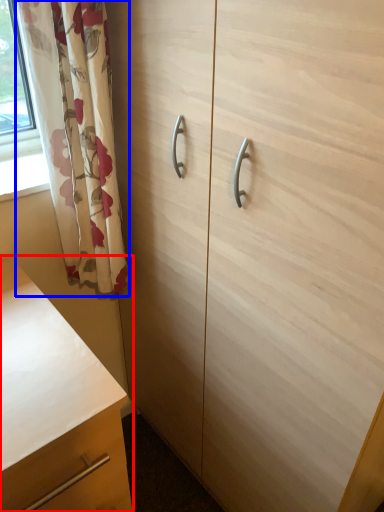
Question: Which object appears closest to the camera in this image, chest of drawers (highlighted by a red box) or curtain (highlighted by a blue box)?

Choices:
 (A) chest of drawers
 (B) curtain

Answer: (A)